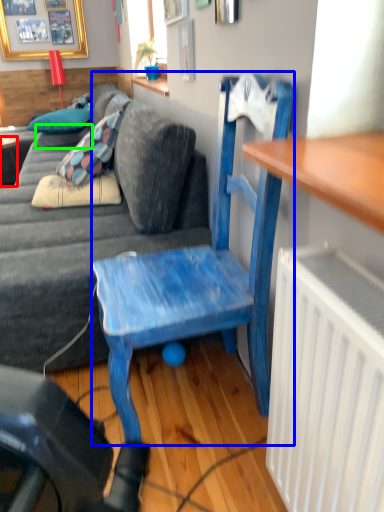
Question: Based on their relative distances, which object is farther from desk (highlighted by a red box)? Choose from chair (highlighted by a blue box) and pillow (highlighted by a green box).

Choices:
 (A) chair
 (B) pillow

Answer: (A)